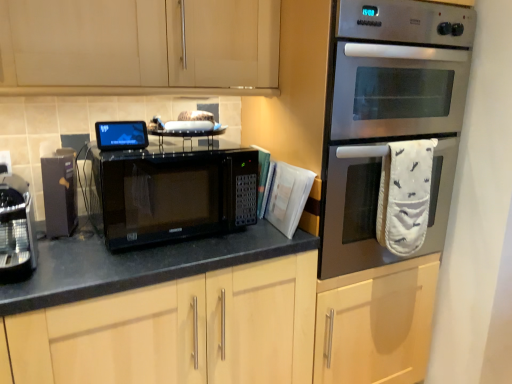
In order to click on free space in front of black matte microwave at center in this screenshot , I will do 132,263.